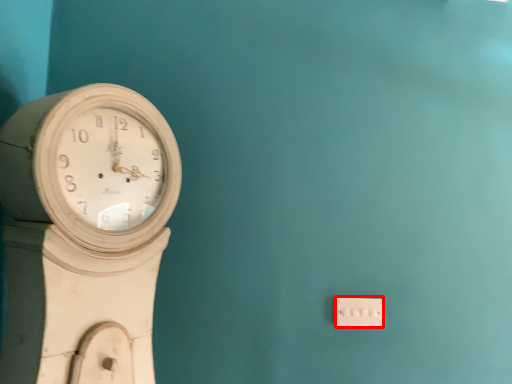
Question: From the image's perspective, where is electric outlet (annotated by the red box) located relative to wall clock?

Choices:
 (A) above
 (B) below

Answer: (B)